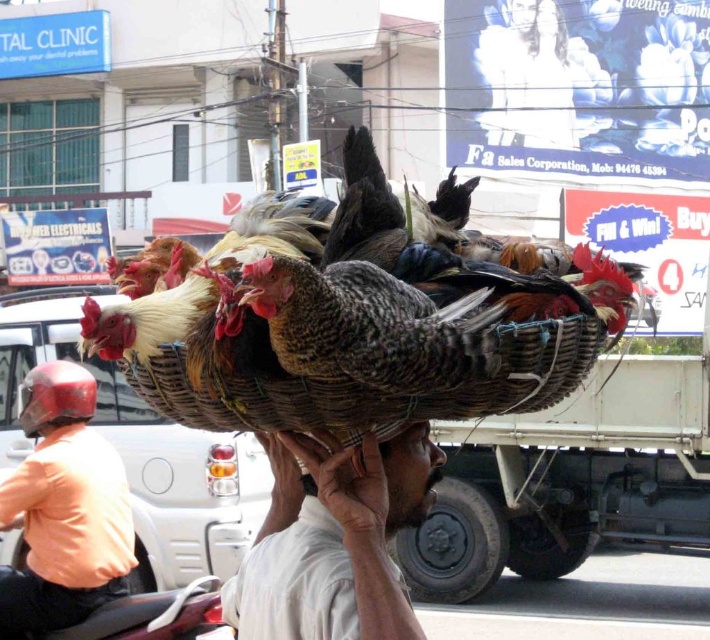
You are a delivery person who needs to place a 5 inch long package between the woven bamboo basket at center and the speckled feathered chicken at center. Is there enough space?

The woven bamboo basket at center is 4.82 inches away from the speckled feathered chicken at center. Since the package is 5 inches long, there isn not enough space to place it between them.

You are a delivery person who needs to place a package at the exact location of the point marked at coordinates (371, 387). Where should you place the package in the scene?

The point at coordinates (371, 387) corresponds to the woven bamboo basket at center, so you should place the package at the woven bamboo basket at center.

You are a delivery drone flying at an altitude of 6 feet above the ground. You need to drop a package into the white woven basket at center. Is the basket within your dropping range?

The distance between the white woven basket at center and the camera is 5.74 feet. Since the drone is flying at 6 feet altitude, the basket is within the dropping range.